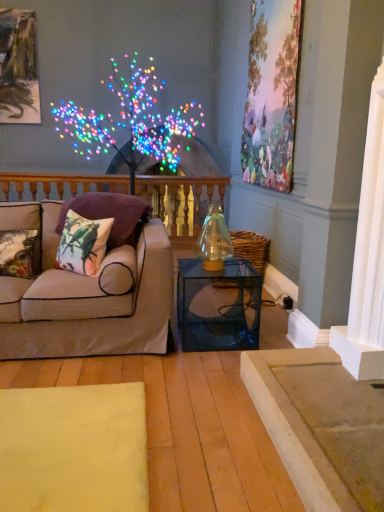
Question: From the image's perspective, does printed fabric pillow at left, positioned as the 2th pillow in left-to-right order, appear lower than floral fabric cushion at left, which is the third pillow from right to left?

Choices:
 (A) yes
 (B) no

Answer: (B)

Question: Does printed fabric pillow at left, the second pillow viewed from the right, have a smaller size compared to floral fabric cushion at left, marked as the 1th pillow in a left-to-right arrangement?

Choices:
 (A) no
 (B) yes

Answer: (A)

Question: Does printed fabric pillow at left, positioned as the 2th pillow in left-to-right order, lie behind floral fabric cushion at left, which is the third pillow from right to left?

Choices:
 (A) yes
 (B) no

Answer: (B)

Question: Considering the relative positions of printed fabric pillow at left, the second pillow viewed from the right, and floral fabric cushion at left, which is the third pillow from right to left, in the image provided, is printed fabric pillow at left, the second pillow viewed from the right, to the left of floral fabric cushion at left, which is the third pillow from right to left, from the viewer's perspective?

Choices:
 (A) no
 (B) yes

Answer: (A)

Question: Can you confirm if printed fabric pillow at left, positioned as the 2th pillow in left-to-right order, is shorter than floral fabric cushion at left, which is the third pillow from right to left?

Choices:
 (A) no
 (B) yes

Answer: (A)

Question: Is printed fabric pillow at left, positioned as the 2th pillow in left-to-right order, wider than floral fabric cushion at left, which is the third pillow from right to left?

Choices:
 (A) yes
 (B) no

Answer: (B)

Question: Is printed fabric pillow at left, positioned as the 2th pillow in left-to-right order, next to transparent glass table at center?

Choices:
 (A) yes
 (B) no

Answer: (B)

Question: Can you confirm if printed fabric pillow at left, the second pillow viewed from the right, is taller than transparent glass table at center?

Choices:
 (A) yes
 (B) no

Answer: (B)

Question: Can you confirm if printed fabric pillow at left, the second pillow viewed from the right, is smaller than transparent glass table at center?

Choices:
 (A) no
 (B) yes

Answer: (B)

Question: From the image's perspective, does printed fabric pillow at left, the second pillow viewed from the right, appear higher than transparent glass table at center?

Choices:
 (A) no
 (B) yes

Answer: (B)

Question: From the image's perspective, would you say printed fabric pillow at left, positioned as the 2th pillow in left-to-right order, is shown under transparent glass table at center?

Choices:
 (A) no
 (B) yes

Answer: (A)

Question: Is printed fabric pillow at left, the second pillow viewed from the right, wider than transparent glass table at center?

Choices:
 (A) no
 (B) yes

Answer: (A)

Question: Are printed fabric pillow at left, the second pillow viewed from the right, and metallic gold picture frame at upper left, acting as the second picture frame starting from the right, far apart?

Choices:
 (A) no
 (B) yes

Answer: (B)